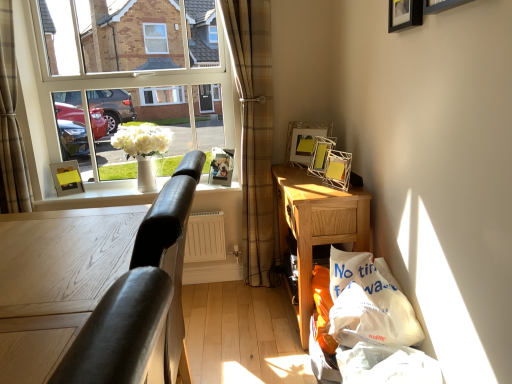
The image size is (512, 384). What are the coordinates of `vacant area on top of black leather table at left (from a real-world perspective)` in the screenshot? It's located at (64, 256).